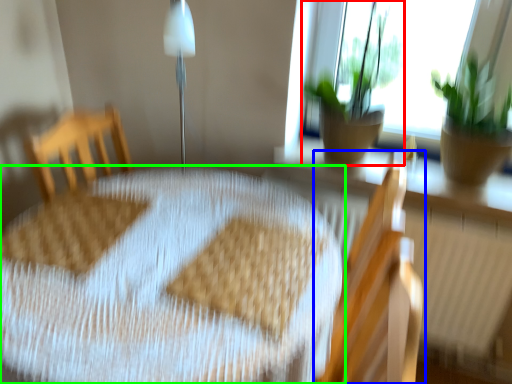
Question: Which is nearer to the houseplant (highlighted by a red box)? chair (highlighted by a blue box) or table (highlighted by a green box).

Choices:
 (A) chair
 (B) table

Answer: (A)